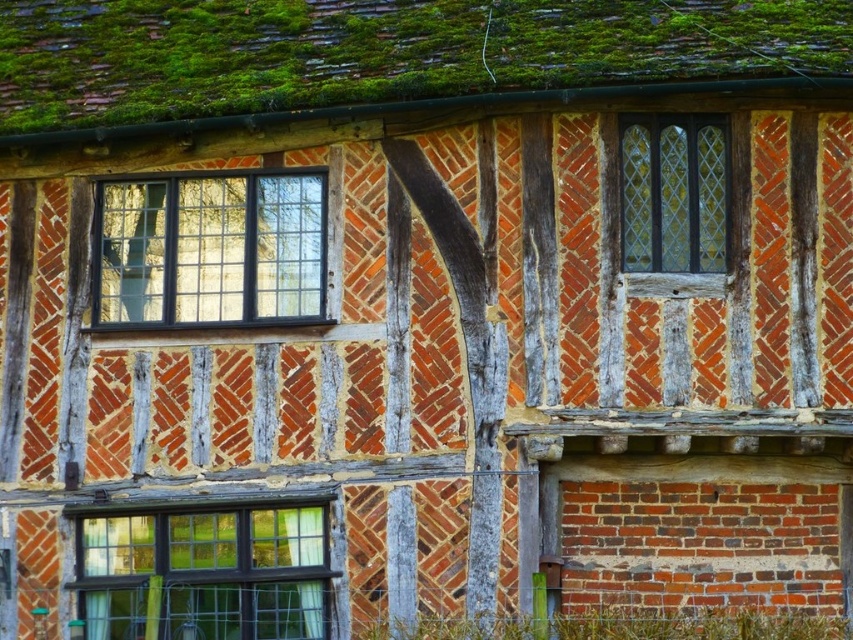
Question: Observing the image, what is the correct spatial positioning of black glass window at upper left in reference to matte black window at lower left?

Choices:
 (A) below
 (B) above

Answer: (B)

Question: Which point is closer to the camera?

Choices:
 (A) (125, 611)
 (B) (738, 64)
 (C) (242, 316)
 (D) (646, 269)

Answer: (B)

Question: Is black glass window at upper left above matte black window at lower left?

Choices:
 (A) no
 (B) yes

Answer: (B)

Question: Among these points, which one is farthest from the camera?

Choices:
 (A) (172, 609)
 (B) (572, 17)
 (C) (714, 154)

Answer: (B)

Question: From the image, what is the correct spatial relationship of matte black window at lower left in relation to clear glass window at upper right?

Choices:
 (A) right
 (B) left

Answer: (B)

Question: Estimate the real-world distances between objects in this image. Which object is closer to the black glass window at upper left?

Choices:
 (A) clear glass window at upper right
 (B) green mossy tiles at upper center
 (C) matte black window at lower left

Answer: (B)